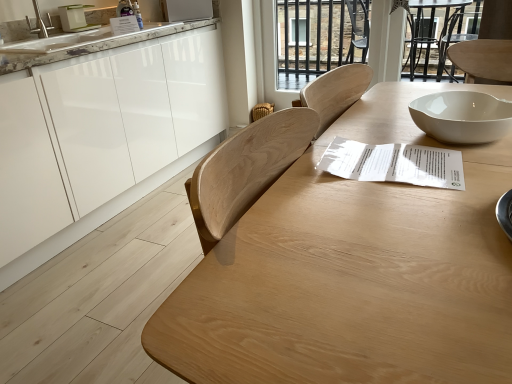
The width and height of the screenshot is (512, 384). What do you see at coordinates (119, 129) in the screenshot?
I see `white glossy cabinets at left` at bounding box center [119, 129].

In order to face transparent glass door at upper center, should I rotate leftwards or rightwards?

To face it directly, rotate right by 8.735 degrees.

What are the coordinates of `natural wood table at center` in the screenshot? It's located at (354, 272).

I want to click on white glossy bowl at upper right, so click(x=462, y=116).

Describe the element at coordinates (261, 111) in the screenshot. I see `woven straw chair at center` at that location.

Measure the distance between point (261, 103) and camera.

The distance of point (261, 103) from camera is 3.11 meters.

The height and width of the screenshot is (384, 512). Find the location of `white glossy cabinets at left`. white glossy cabinets at left is located at coordinates (119, 129).

Considering the sizes of natural wood table at center and white glossy cabinets at left in the image, is natural wood table at center taller or shorter than white glossy cabinets at left?

Considering their sizes, natural wood table at center has less height than white glossy cabinets at left.

Does natural wood table at center have a larger size compared to white glossy cabinets at left?

No.

Is point (226, 347) more distant than point (89, 158)?

No, (226, 347) is closer to viewer.

At what (x,y) coordinates should I click in order to perform the action: click on cabinetry below the natural wood table at center (from a real-world perspective). Please return your answer as a coordinate pair (x, y). The height and width of the screenshot is (384, 512). Looking at the image, I should click on (119, 129).

From a real-world perspective, which object stands above the other?

From a 3D spatial view, white glossy microwave at upper center is above.

Which object is positioned more to the left, white glossy cabinets at left or white glossy microwave at upper center?

Positioned to the left is white glossy cabinets at left.

Is white glossy cabinets at left not within white glossy microwave at upper center?

Yes, white glossy cabinets at left is not within white glossy microwave at upper center.

Between white glossy bowl at upper right and white glossy cabinets at left, which one is positioned in front?

white glossy bowl at upper right is in front.

Does white glossy bowl at upper right have a smaller size compared to white glossy cabinets at left?

Yes, white glossy bowl at upper right is smaller than white glossy cabinets at left.

Between white glossy bowl at upper right and white glossy cabinets at left, which one has larger width?

Wider between the two is white glossy cabinets at left.

Considering the sizes of objects white glossy bowl at upper right and white glossy cabinets at left in the image provided, who is shorter, white glossy bowl at upper right or white glossy cabinets at left?

Standing shorter between the two is white glossy bowl at upper right.

From a real-world perspective, is white marble countertop at upper left over white paper at center?

Indeed, from a real-world perspective, white marble countertop at upper left stands above white paper at center.

Is white marble countertop at upper left aimed at white paper at center?

Yes.

Can you confirm if white marble countertop at upper left is bigger than white paper at center?

Indeed, white marble countertop at upper left has a larger size compared to white paper at center.

Between white marble countertop at upper left and white paper at center, which one has less height?

white paper at center is shorter.

Is natural wood table at center looking in the opposite direction of white paper at center?

No, natural wood table at center is not facing away from white paper at center.

Between natural wood table at center and white paper at center, which one has more height?

natural wood table at center.

In the image, is natural wood table at center positioned in front of or behind white paper at center?

Clearly, natural wood table at center is in front of white paper at center.

Looking at their sizes, would you say natural wood table at center is wider or thinner than white paper at center?

Clearly, natural wood table at center has more width compared to white paper at center.

The height and width of the screenshot is (384, 512). In order to click on glass door beneath the white marble countertop at upper left (from a real-world perspective) in this screenshot , I will do pos(319,38).

Looking at this image, is white marble countertop at upper left positioned far away from transparent glass door at upper center?

Absolutely, white marble countertop at upper left is distant from transparent glass door at upper center.

How many degrees apart are the facing directions of white marble countertop at upper left and transparent glass door at upper center?

There is a 89.7-degree angle between the facing directions of white marble countertop at upper left and transparent glass door at upper center.

Is white marble countertop at upper left facing away from transparent glass door at upper center?

No, transparent glass door at upper center is not at the back of white marble countertop at upper left.

Considering the sizes of objects white marble countertop at upper left and natural wood table at center in the image provided, who is bigger, white marble countertop at upper left or natural wood table at center?

With larger size is natural wood table at center.

Is white marble countertop at upper left not near natural wood table at center?

Yes.

How many degrees apart are the facing directions of white marble countertop at upper left and natural wood table at center?

They differ by 1.47 degrees in their facing directions.

Which object is further away from the camera taking this photo, white marble countertop at upper left or natural wood table at center?

white marble countertop at upper left is further away from the camera.

Locate an element on the screen. table above the white glossy cabinets at left (from a real-world perspective) is located at coordinates (354, 272).

At what (x,y) coordinates should I click in order to perform the action: click on cabinetry that is in front of the white glossy microwave at upper center. Please return your answer as a coordinate pair (x, y). The width and height of the screenshot is (512, 384). Looking at the image, I should click on (119, 129).

From the image, which object appears to be nearer to white marble countertop at upper left, natural wood table at center or woven straw chair at center?

The object closer to white marble countertop at upper left is woven straw chair at center.

Estimate the real-world distances between objects in this image. Which object is further from white paper at center, white glossy cabinets at left or white glossy bowl at upper right?

Based on the image, white glossy cabinets at left appears to be further to white paper at center.

From the image, which object appears to be nearer to white glossy microwave at upper center, white glossy bowl at upper right or white glossy cabinets at left?

Based on the image, white glossy cabinets at left appears to be nearer to white glossy microwave at upper center.

From the picture: Estimate the real-world distances between objects in this image. Which object is closer to white glossy bowl at upper right, woven straw chair at center or white paper at center?

white paper at center is positioned closer to the anchor white glossy bowl at upper right.

From the image, which object appears to be nearer to white glossy bowl at upper right, white paper at center or white glossy microwave at upper center?

white paper at center is positioned closer to the anchor white glossy bowl at upper right.

From the image, which object appears to be farther from white paper at center, white marble countertop at upper left or white glossy cabinets at left?

The object further to white paper at center is white glossy cabinets at left.

Looking at the image, which one is located further to natural wood table at center, transparent glass door at upper center or white glossy bowl at upper right?

transparent glass door at upper center is further to natural wood table at center.

Based on their spatial positions, is natural wood table at center or white marble countertop at upper left closer to white glossy bowl at upper right?

natural wood table at center lies closer to white glossy bowl at upper right than the other object.

At what (x,y) coordinates should I click in order to perform the action: click on bowl positioned between natural wood table at center and woven straw chair at center from near to far. Please return your answer as a coordinate pair (x, y). This screenshot has height=384, width=512. Looking at the image, I should click on (462, 116).

Find the location of a particular element. The height and width of the screenshot is (384, 512). countertop positioned between white paper at center and woven straw chair at center from near to far is located at coordinates (86, 45).

Find the location of a particular element. paper situated between white marble countertop at upper left and white glossy bowl at upper right from left to right is located at coordinates (394, 164).

Locate an element on the screen. The image size is (512, 384). chair between white glossy microwave at upper center and transparent glass door at upper center is located at coordinates (261, 111).